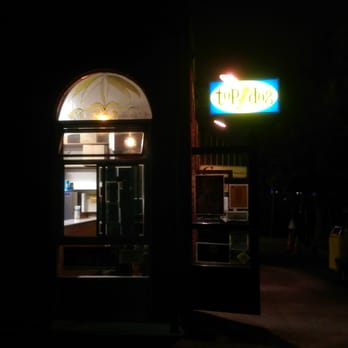
Locate an element on the screen. The image size is (348, 348). flooring is located at coordinates (282, 280), (286, 306), (256, 330), (153, 325).